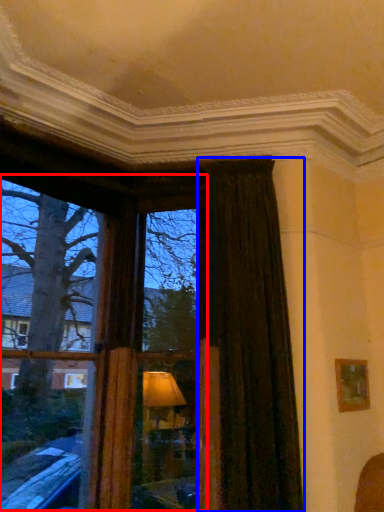
Question: Which object is further to the camera taking this photo, bay window (highlighted by a red box) or curtain (highlighted by a blue box)?

Choices:
 (A) bay window
 (B) curtain

Answer: (B)